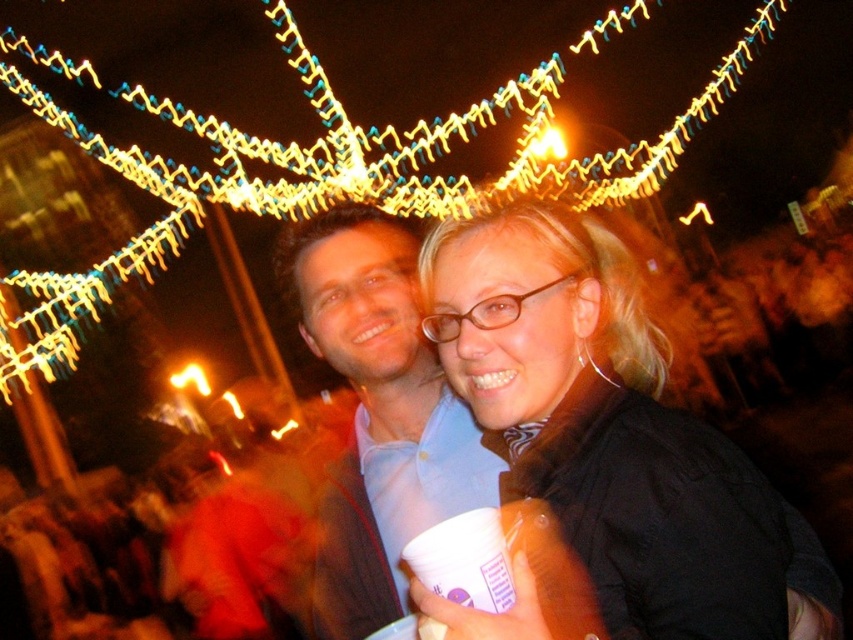
Question: Which of the following is the closest to the observer?

Choices:
 (A) matte blue shirt at center
 (B) black matte jacket at center

Answer: (B)

Question: Can you confirm if yellow string lights at upper center is positioned to the left of matte blue shirt at center?

Choices:
 (A) no
 (B) yes

Answer: (A)

Question: Considering the real-world distances, which object is farthest from the yellow string lights at upper center?

Choices:
 (A) black matte jacket at center
 (B) matte blue shirt at center

Answer: (B)

Question: Which of the following is the farthest from the observer?

Choices:
 (A) yellow string lights at upper center
 (B) matte blue shirt at center

Answer: (B)

Question: Is black matte jacket at center bigger than yellow string lights at upper center?

Choices:
 (A) no
 (B) yes

Answer: (A)

Question: Can you confirm if black matte jacket at center is smaller than yellow string lights at upper center?

Choices:
 (A) no
 (B) yes

Answer: (B)